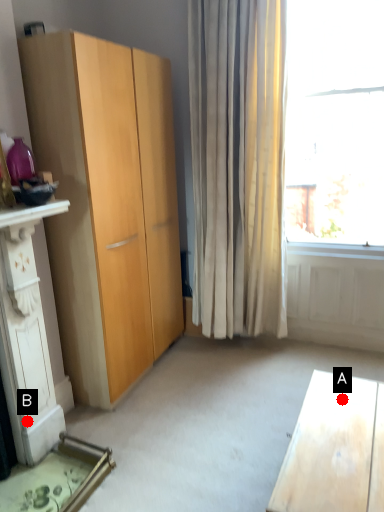
Question: Two points are circled on the image, labeled by A and B beside each circle. Which point is farther to the camera?

Choices:
 (A) A is further
 (B) B is further

Answer: (B)